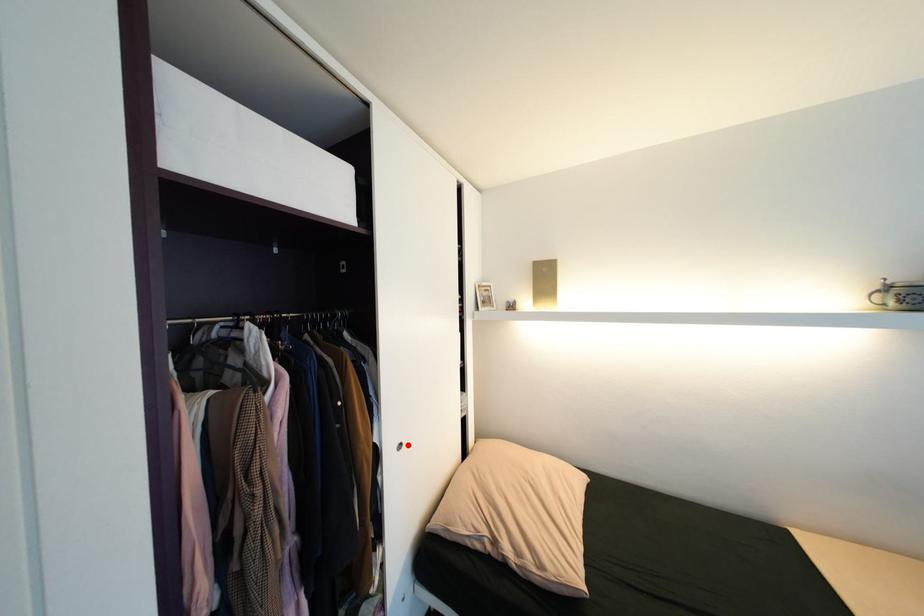
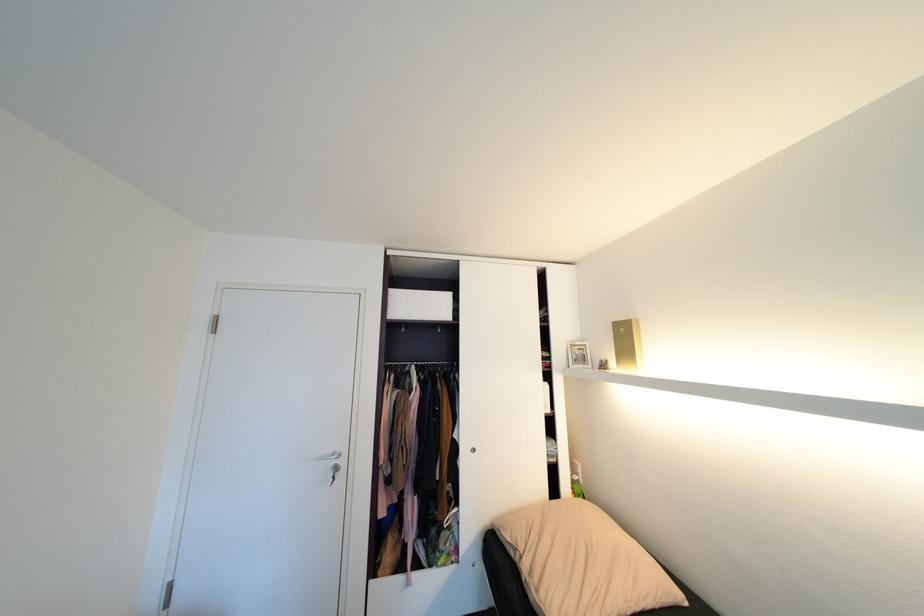
Question: I am providing you with two images of the same scene from different viewpoints. A red point is shown in image1. For the corresponding object point in image2, is it positioned nearer or farther from the camera?

Choices:
 (A) Nearer
 (B) Farther

Answer: (B)